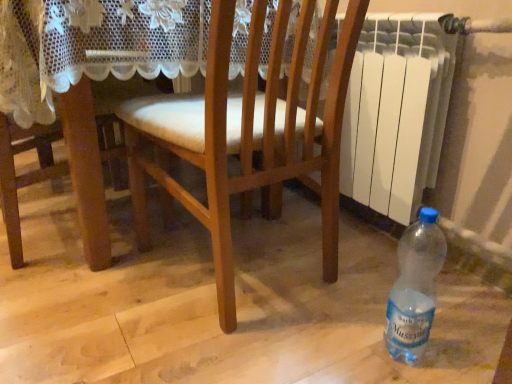
Question: Considering the relative sizes of translucent plastic bottle at lower right and wooden chair at center in the image provided, is translucent plastic bottle at lower right shorter than wooden chair at center?

Choices:
 (A) no
 (B) yes

Answer: (B)

Question: Is wooden chair at center a part of translucent plastic bottle at lower right?

Choices:
 (A) yes
 (B) no

Answer: (B)

Question: From the image's perspective, would you say translucent plastic bottle at lower right is positioned over wooden chair at center?

Choices:
 (A) yes
 (B) no

Answer: (B)

Question: Can you confirm if translucent plastic bottle at lower right is thinner than wooden chair at center?

Choices:
 (A) yes
 (B) no

Answer: (A)

Question: Is translucent plastic bottle at lower right not within wooden chair at center?

Choices:
 (A) yes
 (B) no

Answer: (A)

Question: Is translucent plastic bottle at lower right wider or thinner than wooden chair at center?

Choices:
 (A) thin
 (B) wide

Answer: (A)

Question: In terms of height, does translucent plastic bottle at lower right look taller or shorter compared to wooden chair at center?

Choices:
 (A) tall
 (B) short

Answer: (B)

Question: In the image, is translucent plastic bottle at lower right positioned in front of or behind wooden chair at center?

Choices:
 (A) front
 (B) behind

Answer: (B)

Question: In terms of size, does translucent plastic bottle at lower right appear bigger or smaller than wooden chair at center?

Choices:
 (A) small
 (B) big

Answer: (A)

Question: Considering the positions of translucent plastic bottle at lower right and white plastic radiator at right in the image, is translucent plastic bottle at lower right bigger or smaller than white plastic radiator at right?

Choices:
 (A) small
 (B) big

Answer: (A)

Question: Looking at their shapes, would you say translucent plastic bottle at lower right is wider or thinner than white plastic radiator at right?

Choices:
 (A) thin
 (B) wide

Answer: (A)

Question: In the image, is translucent plastic bottle at lower right on the left side or the right side of white plastic radiator at right?

Choices:
 (A) left
 (B) right

Answer: (A)

Question: Is point (417, 226) closer or farther from the camera than point (442, 36)?

Choices:
 (A) closer
 (B) farther

Answer: (A)

Question: From a real-world perspective, is white plastic radiator at right physically located above or below translucent plastic bottle at lower right?

Choices:
 (A) below
 (B) above

Answer: (B)

Question: From the image's perspective, is white plastic radiator at right positioned above or below translucent plastic bottle at lower right?

Choices:
 (A) below
 (B) above

Answer: (B)